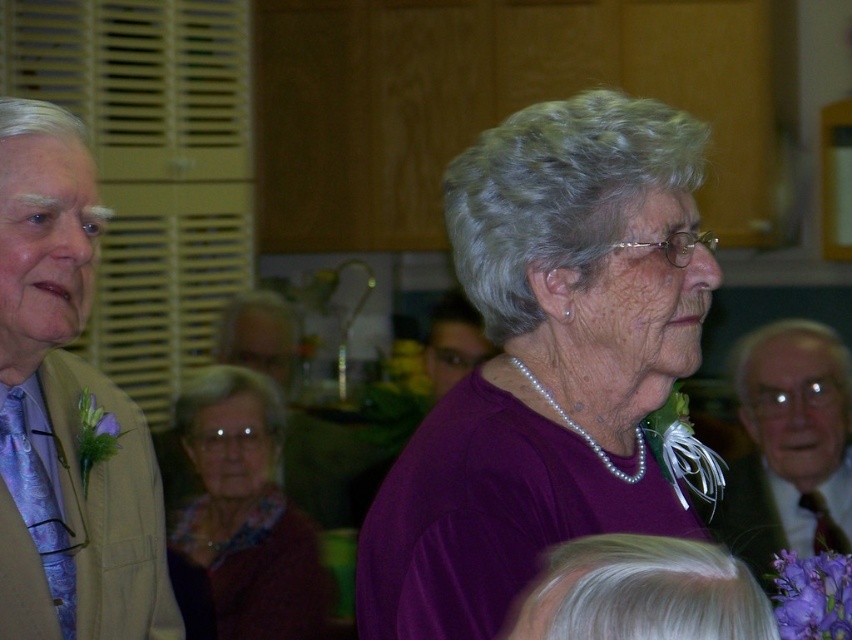
Question: Which point is closer to the camera taking this photo?

Choices:
 (A) (410, 515)
 (B) (844, 465)
 (C) (91, 179)

Answer: (A)

Question: Which of the following is the farthest from the observer?

Choices:
 (A) purple matte shirt at center
 (B) silky beige suit at left
 (C) matte purple sweater at center
 (D) matte brown suit at right

Answer: (C)

Question: Is purple matte shirt at center bigger than matte brown suit at right?

Choices:
 (A) no
 (B) yes

Answer: (A)

Question: Which object is farther from the camera taking this photo?

Choices:
 (A) matte brown suit at right
 (B) matte purple sweater at center
 (C) silky beige suit at left
 (D) purple matte shirt at center

Answer: (B)

Question: Is purple matte shirt at center thinner than matte brown suit at right?

Choices:
 (A) yes
 (B) no

Answer: (A)

Question: Does silky beige suit at left appear on the left side of matte purple sweater at center?

Choices:
 (A) no
 (B) yes

Answer: (A)